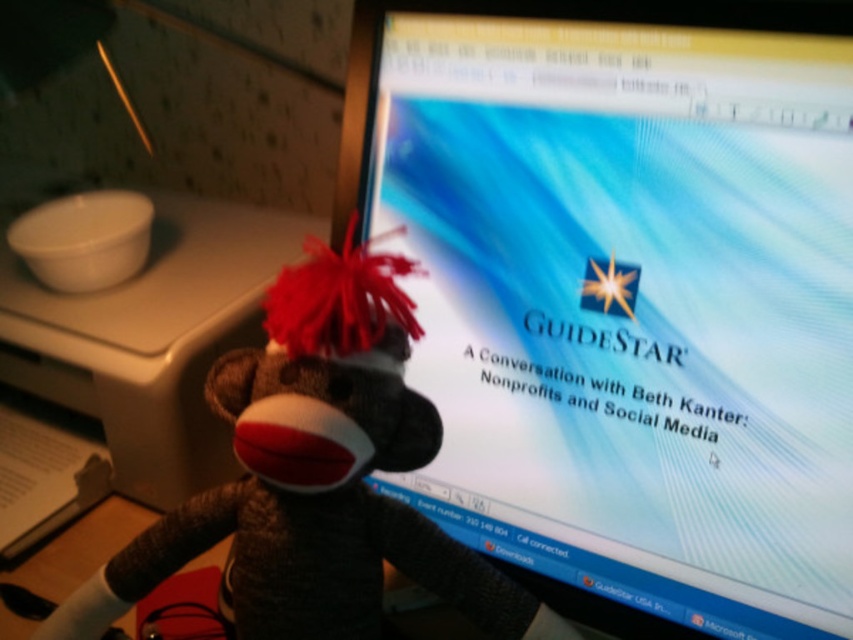
You are a photographer taking a picture of the matte plastic monitor at center and the brown fuzzy sock monkey at center. Which object will appear larger in the photo?

The matte plastic monitor at center will appear larger in the photo because it is closer to the viewer than the brown fuzzy sock monkey at center.

You are a remote worker who needs to place a new 15 cm wide memo pad on your desk. The memo pad must be placed to the right of the matte plastic monitor at center. Can you fit it there without overlapping the monitor?

The matte plastic monitor at center is located at point (625, 296). Since the memo pad is 15 cm wide and needs to be placed to the right of the monitor, we need to know the available space to the right. However, the description does not provide information about the desk size or the monitor dimensions. Without this information, it is impossible to determine if the memo pad will fit without overlapping. Please provide more details about the desk dimensions or the monitor size.

You are organizing a presentation and need to place a name tag on the desk. The name tag is 3 inches tall. The brown fuzzy sock monkey at center and the matte white plastic at left are already on the desk. Can the name tag fit between them vertically?

The brown fuzzy sock monkey at center is located below the matte white plastic at left, so there is vertical space between them. The name tag, being only 3 inches tall, should fit in the space between them.